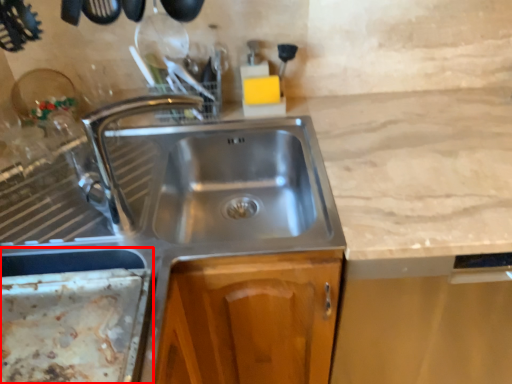
Question: From the image's perspective, considering the relative positions of appliance (annotated by the red box) and tap in the image provided, where is appliance (annotated by the red box) located with respect to the staircase?

Choices:
 (A) below
 (B) above

Answer: (A)